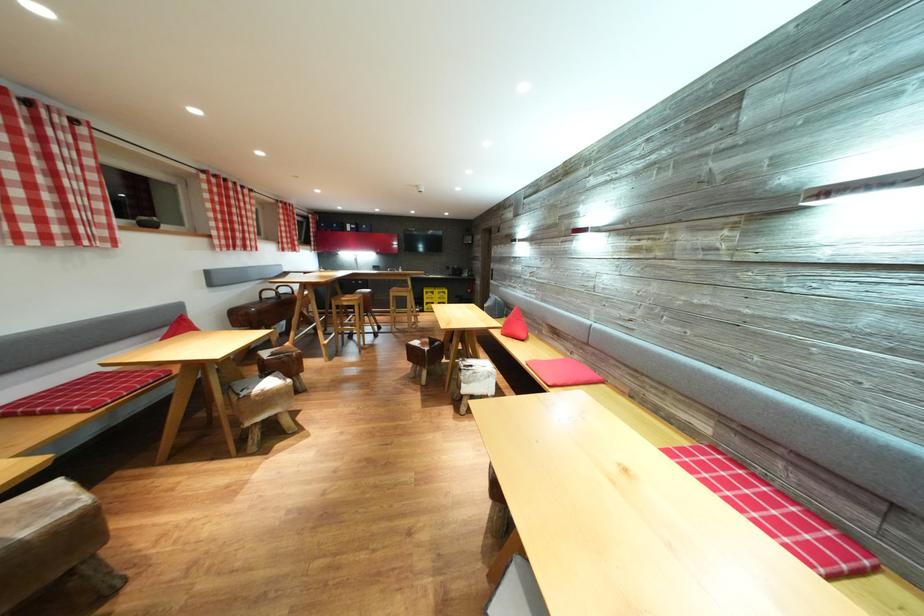
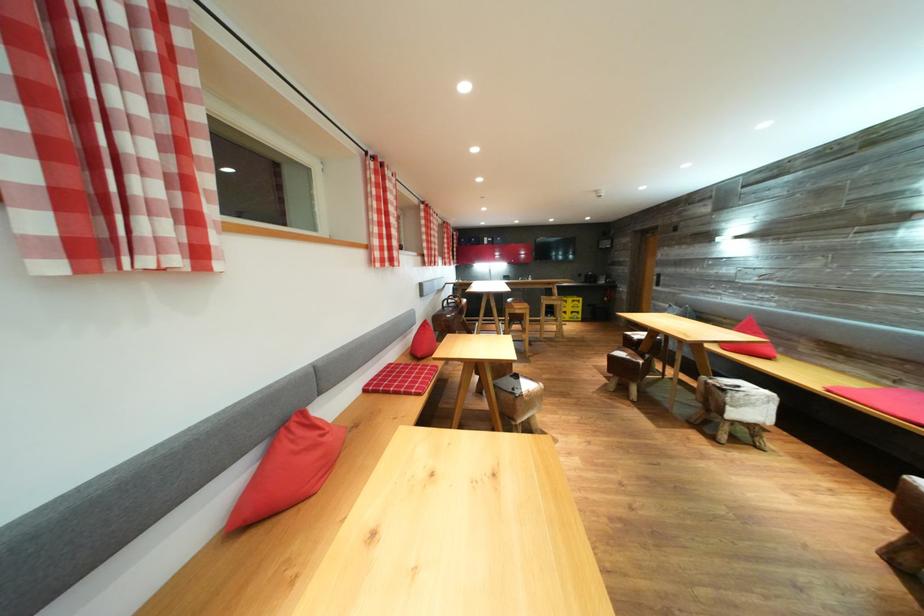
Where in the second image is the point corresponding to point (576, 360) from the first image?

(895, 389)